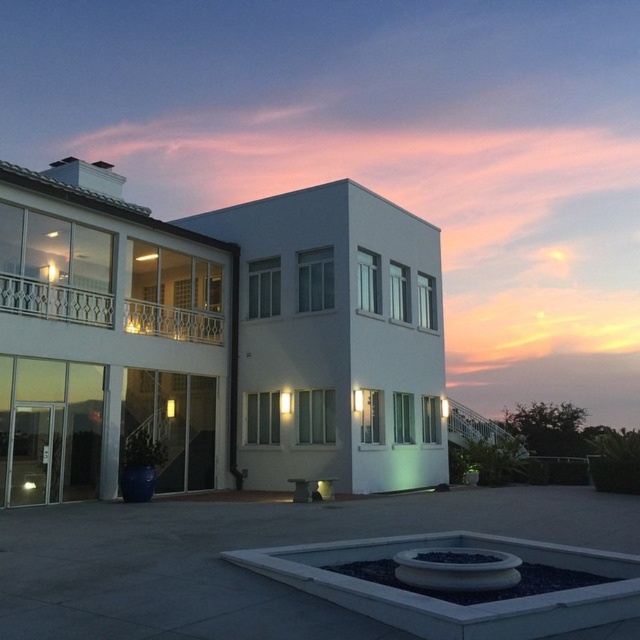
Question: Which point is closer to the camera?

Choices:
 (A) white smooth villa at center
 (B) transparent glass door at lower left
 (C) white wrought iron balcony at upper left

Answer: (A)

Question: Can you confirm if white smooth villa at center is bigger than white wrought iron balcony at upper left?

Choices:
 (A) yes
 (B) no

Answer: (A)

Question: Observing the image, what is the correct spatial positioning of white smooth villa at center in reference to transparent glass door at lower left?

Choices:
 (A) above
 (B) below

Answer: (A)

Question: Does white wrought iron balcony at upper left have a greater width compared to transparent glass door at lower left?

Choices:
 (A) yes
 (B) no

Answer: (B)

Question: Based on their relative distances, which object is nearer to the white wrought iron balcony at upper left?

Choices:
 (A) transparent glass door at lower left
 (B) white smooth villa at center

Answer: (A)

Question: Which point is closer to the camera taking this photo?

Choices:
 (A) (35, 428)
 (B) (182, 332)
 (C) (308, 260)

Answer: (A)